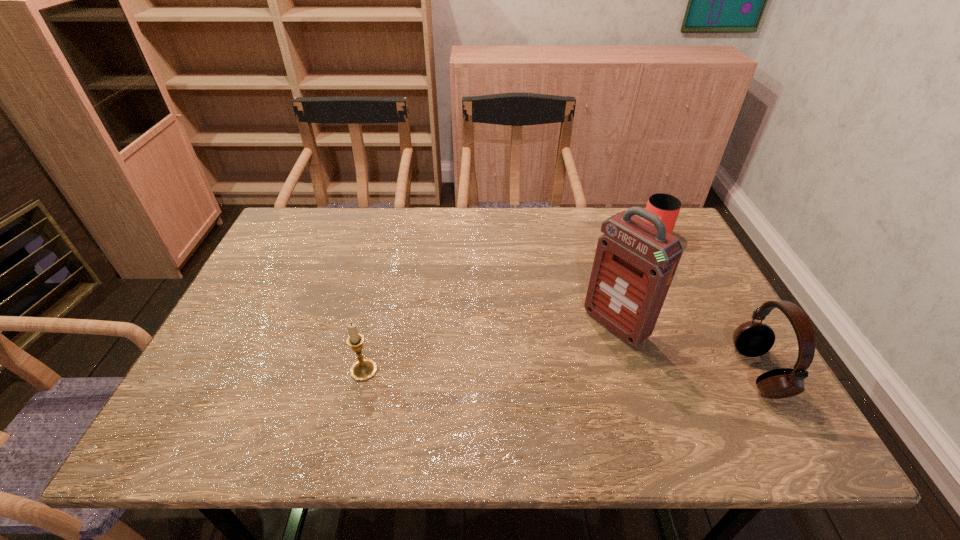
You are a GUI agent. You are given a task and a screenshot of the screen. Output one action in this format:
    pyautogui.click(x=<x>, y=<y>)
    Task: Click on the vacant area that satisfies the following two spatial constraints: 1. on the back side of the cup; 2. on the left side of the first-aid kit
    The height and width of the screenshot is (540, 960).
    Given the screenshot: What is the action you would take?
    pyautogui.click(x=588, y=237)

I want to click on vacant space that satisfies the following two spatial constraints: 1. on the front side of the second tallest object; 2. on the ear pads of the candle holder, so click(x=364, y=372).

Find the location of a particular element. This screenshot has width=960, height=540. free space that satisfies the following two spatial constraints: 1. on the front side of the tallest object; 2. on the ear pads of the second tallest object is located at coordinates (630, 372).

Find the location of a particular element. Image resolution: width=960 pixels, height=540 pixels. vacant point that satisfies the following two spatial constraints: 1. on the front side of the tallest object; 2. on the ear pads of the second tallest object is located at coordinates (630, 372).

Where is `free space that satisfies the following two spatial constraints: 1. on the back side of the leftmost object; 2. on the left side of the second object from left to right`? This screenshot has width=960, height=540. free space that satisfies the following two spatial constraints: 1. on the back side of the leftmost object; 2. on the left side of the second object from left to right is located at coordinates (374, 325).